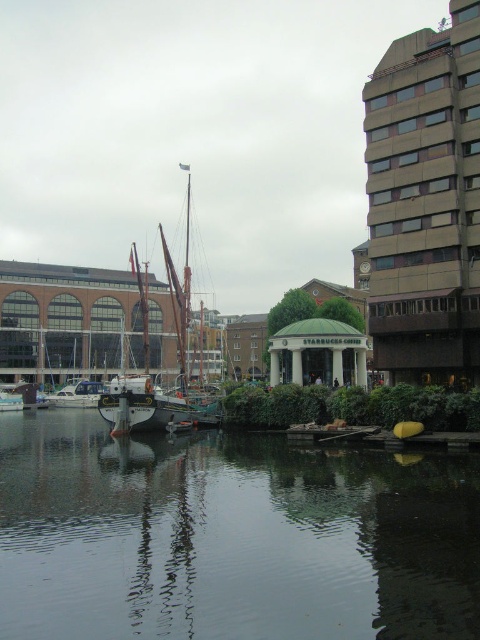
Question: Is smooth dark water at center thinner than wooden dock at center?

Choices:
 (A) no
 (B) yes

Answer: (A)

Question: Which point is closer to the camera?

Choices:
 (A) white glossy boat at center
 (B) wooden sailboat at center
 (C) smooth dark water at center

Answer: (C)

Question: Observing the image, what is the correct spatial positioning of wooden sailboat at center in reference to wooden dock at center?

Choices:
 (A) above
 (B) below

Answer: (A)

Question: Which point appears closest to the camera in this image?

Choices:
 (A) (376, 433)
 (B) (85, 397)
 (C) (248, 586)

Answer: (C)

Question: Can you confirm if wooden sailboat at center is bigger than white glossy boat at center?

Choices:
 (A) no
 (B) yes

Answer: (B)

Question: Among these objects, which one is nearest to the camera?

Choices:
 (A) smooth dark water at center
 (B) wooden sailboat at center

Answer: (A)